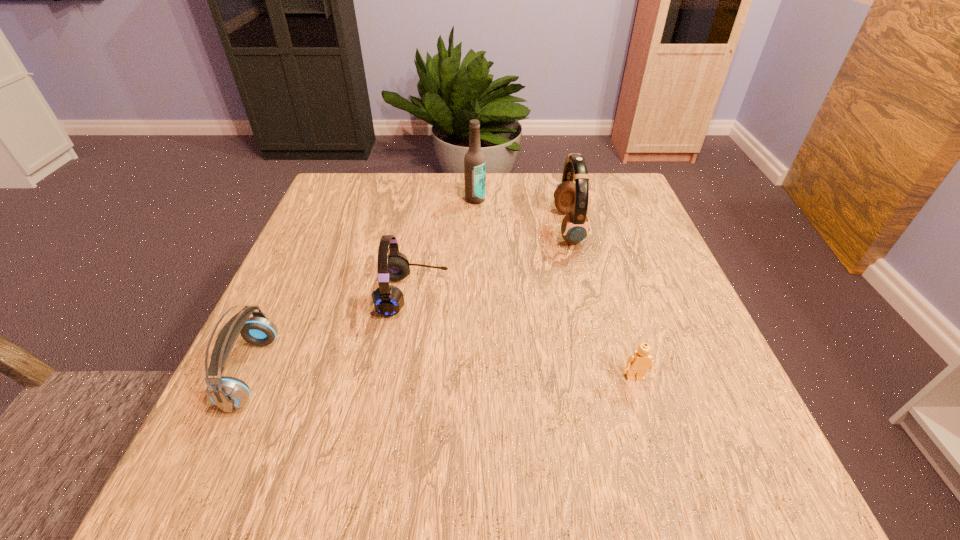
In order to click on vacant space located 0.170m on the ear cup of the tallest headset in this screenshot , I will do `click(485, 228)`.

This screenshot has width=960, height=540. What are the coordinates of `vacant space positioned on the ear cup of the tallest headset` in the screenshot? It's located at 440,228.

Where is `free space located 0.220m on the ear cup of the tallest headset`? free space located 0.220m on the ear cup of the tallest headset is located at coordinates (465, 228).

At what (x,y) coordinates should I click in order to perform the action: click on blank area located on the ear cushions of the second headset from left to right. Please return your answer as a coordinate pair (x, y). This screenshot has height=540, width=960. Looking at the image, I should click on (625, 294).

Find the location of `vacant space located 0.340m on the ear cups of the nearest headset`. vacant space located 0.340m on the ear cups of the nearest headset is located at coordinates (468, 372).

The width and height of the screenshot is (960, 540). In order to click on free location located on the face of the shortest object in this screenshot , I will do `click(669, 490)`.

The height and width of the screenshot is (540, 960). Find the location of `beer bottle present at the far edge`. beer bottle present at the far edge is located at coordinates (474, 161).

Where is `headset situated at the far edge`? The height and width of the screenshot is (540, 960). headset situated at the far edge is located at coordinates (571, 198).

Identify the location of object that is at the left edge. (228, 393).

The height and width of the screenshot is (540, 960). In order to click on object situated at the right edge in this screenshot , I will do `click(638, 363)`.